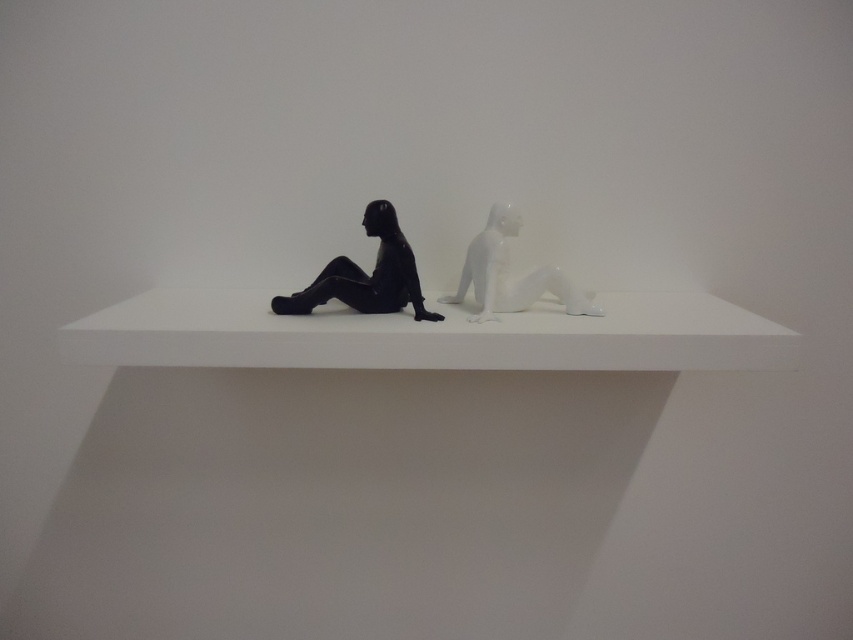
Question: Which object appears closest to the camera in this image?

Choices:
 (A) matte black figure at left
 (B) white glossy statue at center

Answer: (B)

Question: Is white glossy ledge at center smaller than matte black figure at left?

Choices:
 (A) yes
 (B) no

Answer: (B)

Question: Is matte black figure at left above white glossy statue at center?

Choices:
 (A) no
 (B) yes

Answer: (B)

Question: Can you confirm if matte black figure at left is positioned to the left of white glossy statue at center?

Choices:
 (A) no
 (B) yes

Answer: (B)

Question: Which object appears farthest from the camera in this image?

Choices:
 (A) white glossy statue at center
 (B) matte black figure at left
 (C) white glossy ledge at center

Answer: (B)

Question: Estimate the real-world distances between objects in this image. Which object is closer to the white glossy ledge at center?

Choices:
 (A) white glossy statue at center
 (B) matte black figure at left

Answer: (B)